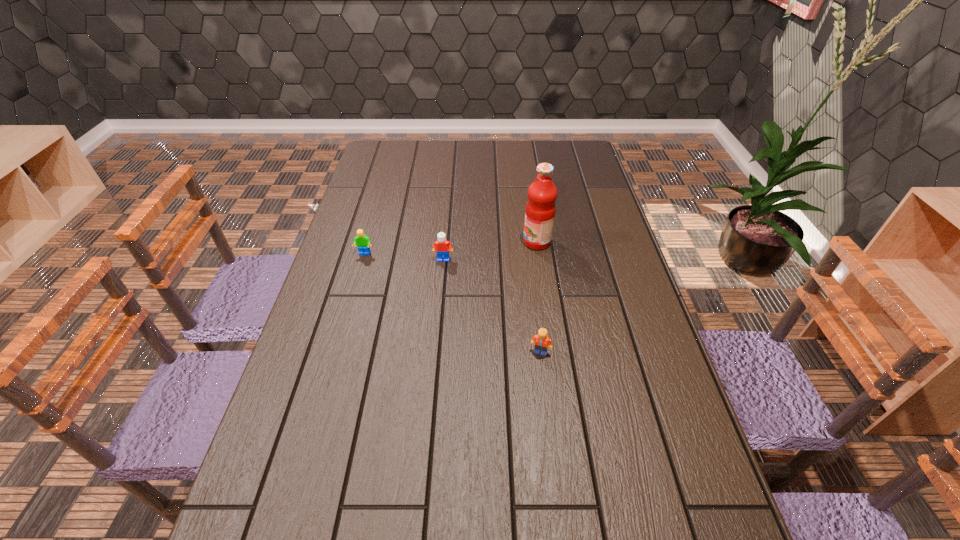
Image resolution: width=960 pixels, height=540 pixels. I want to click on the tallest object, so click(540, 210).

You are a GUI agent. You are given a task and a screenshot of the screen. Output one action in this format:
    pyautogui.click(x=<x>, y=<y>)
    Task: Click on the second object from left to right
    The height and width of the screenshot is (540, 960).
    Given the screenshot: What is the action you would take?
    pyautogui.click(x=443, y=247)

Where is `the leftmost Lego`? This screenshot has height=540, width=960. the leftmost Lego is located at coordinates (362, 241).

Where is `the rightmost Lego`? the rightmost Lego is located at coordinates (541, 341).

I want to click on the nearest object, so click(x=541, y=341).

The height and width of the screenshot is (540, 960). What are the coordinates of `vacant space located on the front label of the tallest object` in the screenshot? It's located at (420, 242).

Where is `vacant region located 0.160m on the front label of the tallest object`? This screenshot has height=540, width=960. vacant region located 0.160m on the front label of the tallest object is located at coordinates (473, 242).

The image size is (960, 540). I want to click on blank space located on the front label of the tallest object, so click(504, 242).

Find the location of `vacant region located 0.380m on the face of the second Lego from left to right`. vacant region located 0.380m on the face of the second Lego from left to right is located at coordinates (434, 366).

The height and width of the screenshot is (540, 960). I want to click on free space located on the face of the leftmost Lego, so click(x=342, y=335).